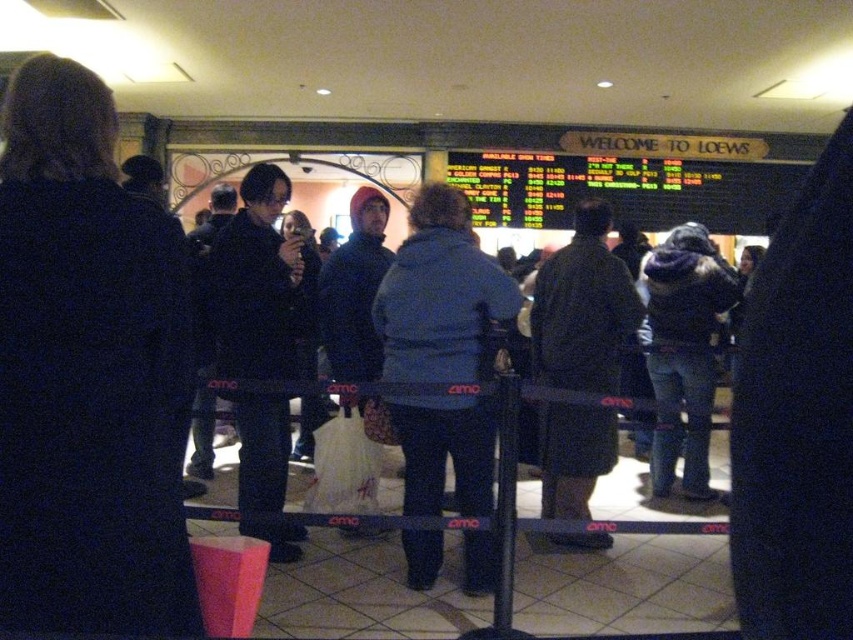
Question: Is the position of blue fleece jacket at center less distant than that of denim jacket at center?

Choices:
 (A) no
 (B) yes

Answer: (B)

Question: Which of the following is the closest to the observer?

Choices:
 (A) dark brown coat at center
 (B) denim jacket at center
 (C) blue fleece jacket at center
 (D) dark blue coat at center

Answer: (D)

Question: Which of the following is the farthest from the observer?

Choices:
 (A) [x=669, y=381]
 (B) [x=415, y=468]
 (C) [x=569, y=476]
 (D) [x=93, y=461]

Answer: (A)

Question: Can you confirm if blue fleece jacket at center is positioned above dark brown coat at center?

Choices:
 (A) no
 (B) yes

Answer: (A)

Question: Which object is farther from the camera taking this photo?

Choices:
 (A) dark brown coat at center
 (B) dark blue coat at center

Answer: (A)

Question: Does dark brown coat at center come behind denim jacket at center?

Choices:
 (A) no
 (B) yes

Answer: (A)